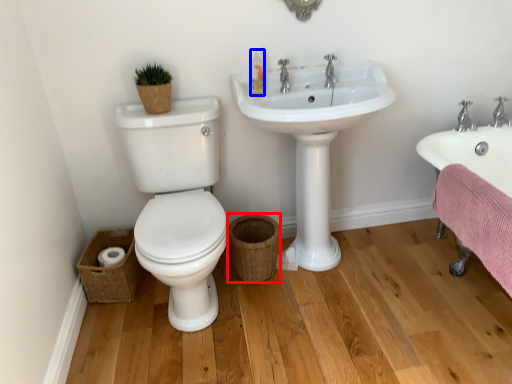
Question: Among these objects, which one is nearest to the camera, basket (highlighted by a red box) or toiletry (highlighted by a blue box)?

Choices:
 (A) basket
 (B) toiletry

Answer: (B)